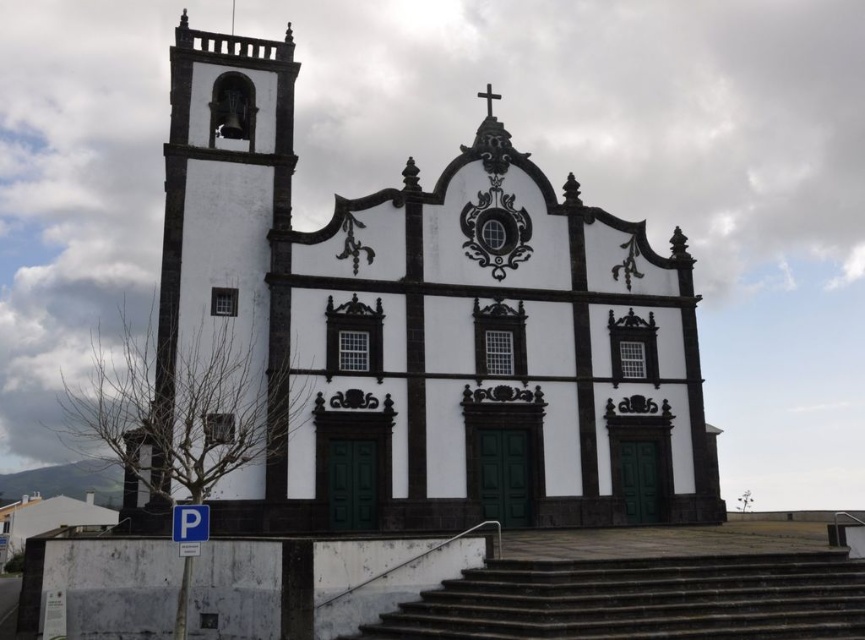
This screenshot has width=865, height=640. Describe the element at coordinates (229, 218) in the screenshot. I see `white stucco bell tower at left` at that location.

Who is more distant from viewer, (x=203, y=228) or (x=815, y=618)?

The point (x=203, y=228) is behind.

Find the location of a particular element. The height and width of the screenshot is (640, 865). white stucco bell tower at left is located at coordinates (229, 218).

Which of these two, white painted stone chapel at center or dark gray concrete stairs at lower center, stands shorter?

With less height is dark gray concrete stairs at lower center.

Is white painted stone chapel at center taller than dark gray concrete stairs at lower center?

Yes, white painted stone chapel at center is taller than dark gray concrete stairs at lower center.

Is point (415, 202) behind point (492, 632)?

That is True.

Where is `white painted stone chapel at center`? The height and width of the screenshot is (640, 865). white painted stone chapel at center is located at coordinates (427, 326).

Can you confirm if white painted stone chapel at center is thinner than white stucco bell tower at left?

Incorrect, white painted stone chapel at center's width is not less than white stucco bell tower at left's.

Does point (227, 58) come farther from viewer compared to point (292, 76)?

That is False.

Where is `white painted stone chapel at center`? The height and width of the screenshot is (640, 865). white painted stone chapel at center is located at coordinates (427, 326).

Where is `white painted stone chapel at center`? The width and height of the screenshot is (865, 640). white painted stone chapel at center is located at coordinates (427, 326).